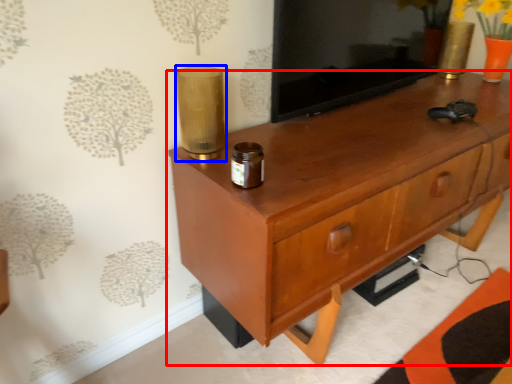
Question: Among these objects, which one is farthest to the camera, chest of drawers (highlighted by a red box) or candle holder (highlighted by a blue box)?

Choices:
 (A) chest of drawers
 (B) candle holder

Answer: (B)